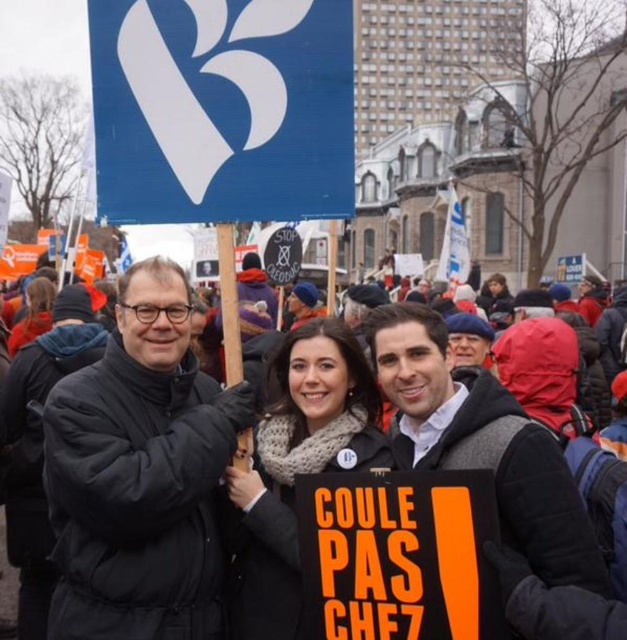
Does point (122, 435) come farther from viewer compared to point (398, 602)?

Yes.

Between black woolen scarf at center and orange paper placard at center, which one appears on the right side from the viewer's perspective?

From the viewer's perspective, orange paper placard at center appears more on the right side.

Is point (127, 406) positioned before point (332, 506)?

No, it is not.

In order to click on black woolen scarf at center in this screenshot , I will do `click(140, 480)`.

This screenshot has height=640, width=627. What are the coordinates of `blue painted wood sign at upper center` in the screenshot? It's located at (221, 109).

Is point (285, 35) positioned after point (229, 605)?

Yes, point (285, 35) is behind point (229, 605).

Where is `blue painted wood sign at upper center`? blue painted wood sign at upper center is located at coordinates (221, 109).

Consider the image. Does knitted scarf at center appear on the right side of orange knit scarf at upper left?

Yes, knitted scarf at center is to the right of orange knit scarf at upper left.

In the scene shown: Who is positioned more to the left, knitted scarf at center or orange knit scarf at upper left?

orange knit scarf at upper left

Is point (367, 461) positioned after point (21, 326)?

No, (367, 461) is in front of (21, 326).

Where is `knitted scarf at center`? Image resolution: width=627 pixels, height=640 pixels. knitted scarf at center is located at coordinates (297, 468).